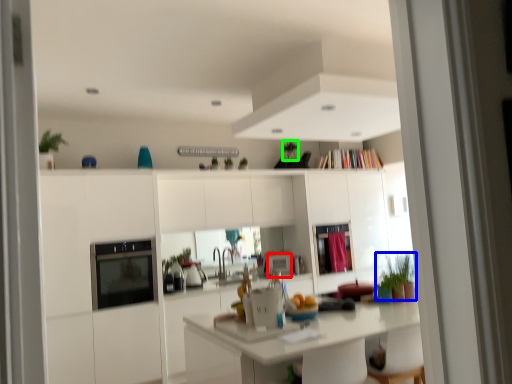
Question: Considering the real-world distances, which object is farthest from appliance (highlighted by a red box)? plant (highlighted by a blue box) or plant (highlighted by a green box)?

Choices:
 (A) plant
 (B) plant

Answer: (A)